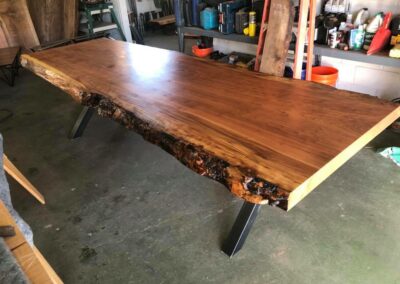
Where is `gray countertop`? Image resolution: width=400 pixels, height=284 pixels. gray countertop is located at coordinates (359, 54).